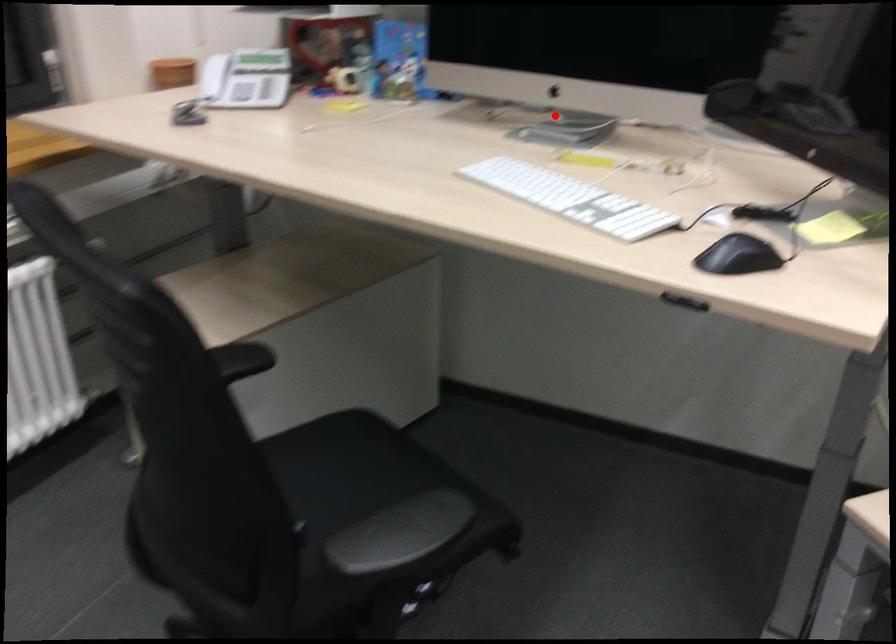
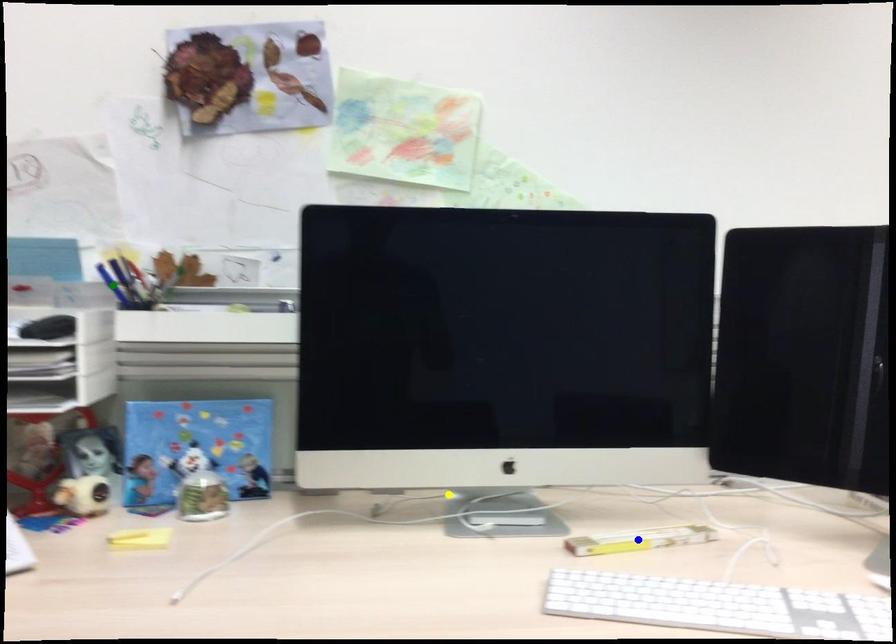
Question: I am providing you with two images of the same scene from different viewpoints. A red point is marked on the first image. You are given multiple points on the second image. Which mark in image 2 goes with the point in image 1?

Choices:
 (A) blue point
 (B) green point
 (C) yellow point

Answer: (C)